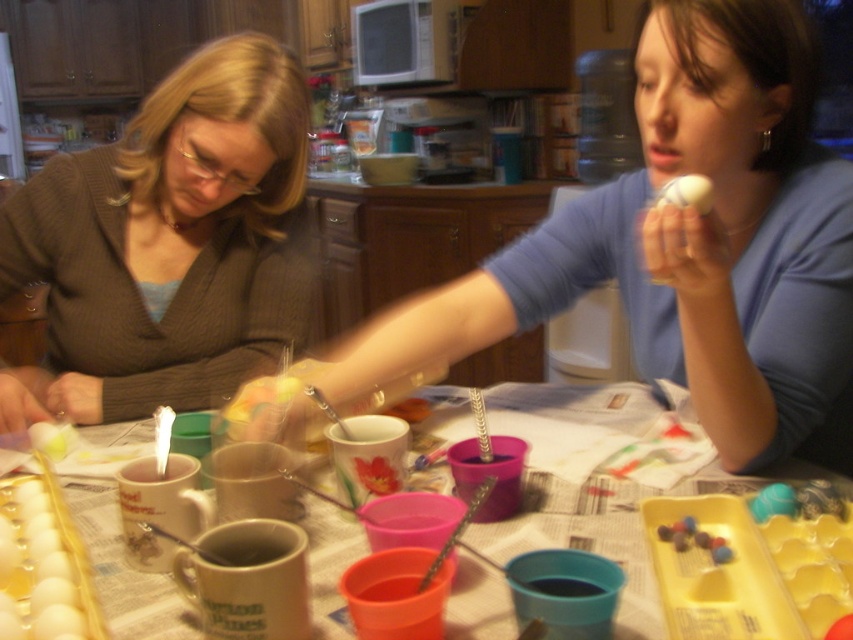
From the picture: Which of these two, matte brown sweater at center or matte yellow egg at upper center, stands taller?

matte brown sweater at center

Is point (287, 65) farther from viewer compared to point (703, 198)?

Yes, it is behind point (703, 198).

Where is `matte brown sweater at center`? matte brown sweater at center is located at coordinates (167, 244).

Can you confirm if matte plastic table at center is positioned to the left of matte yellow egg at upper center?

Correct, you'll find matte plastic table at center to the left of matte yellow egg at upper center.

Who is taller, matte plastic table at center or matte yellow egg at upper center?

With more height is matte plastic table at center.

In order to click on matte plastic table at center in this screenshot , I will do `click(125, 572)`.

You are a GUI agent. You are given a task and a screenshot of the screen. Output one action in this format:
    pyautogui.click(x=<x>, y=<y>)
    Task: Click on the matte plastic table at center
    The height and width of the screenshot is (640, 853).
    Given the screenshot: What is the action you would take?
    pyautogui.click(x=125, y=572)

Locate an element on the screen. This screenshot has height=640, width=853. matte brown sweater at center is located at coordinates (167, 244).

Consider the image. Does matte brown sweater at center have a lesser height compared to matte plastic table at center?

No.

Where is `matte brown sweater at center`? This screenshot has height=640, width=853. matte brown sweater at center is located at coordinates (167, 244).